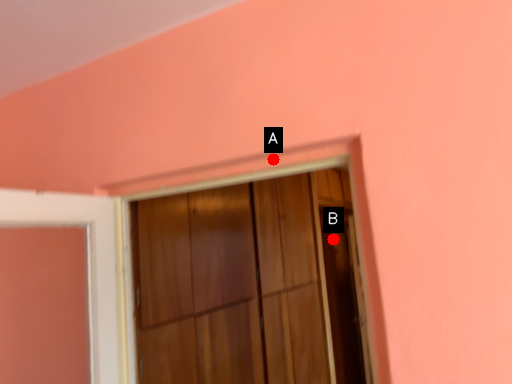
Question: Two points are circled on the image, labeled by A and B beside each circle. Which of the following is the farthest from the observer?

Choices:
 (A) A is further
 (B) B is further

Answer: (B)